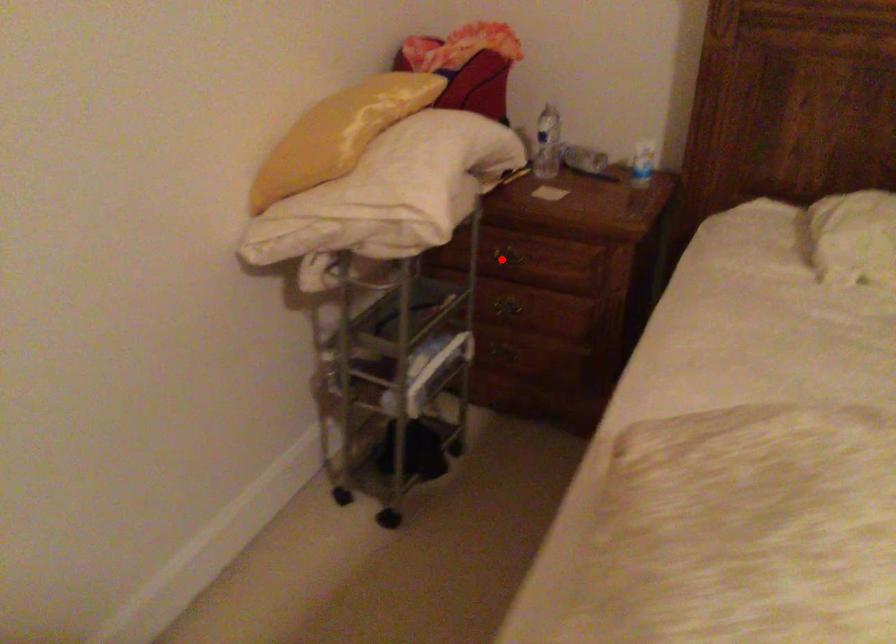
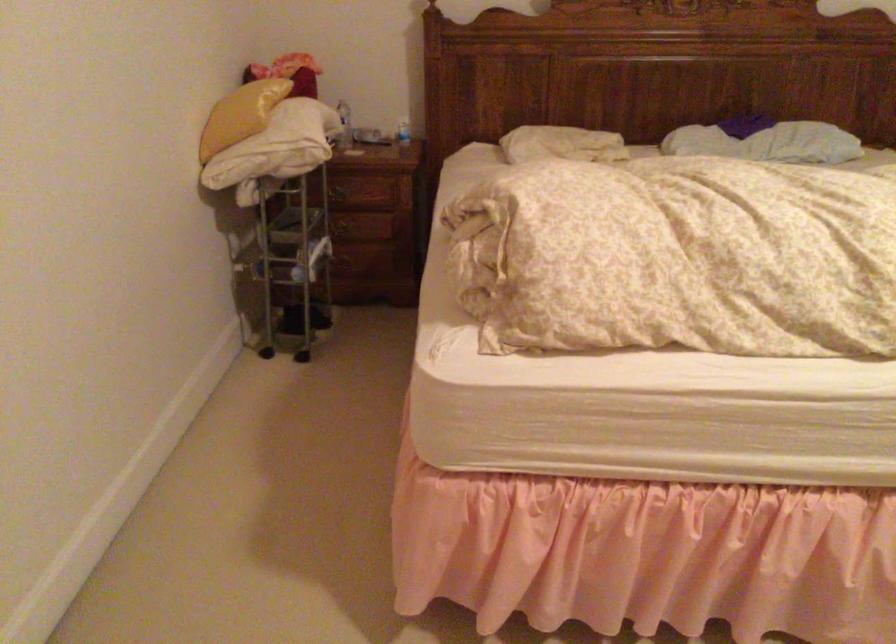
Question: I am providing you with two images of the same scene from different viewpoints. Image1 has a red point marked. In image2, the corresponding 3D location appears at what relative position? Reply with the corresponding letter.

Choices:
 (A) Closer
 (B) Farther

Answer: (B)